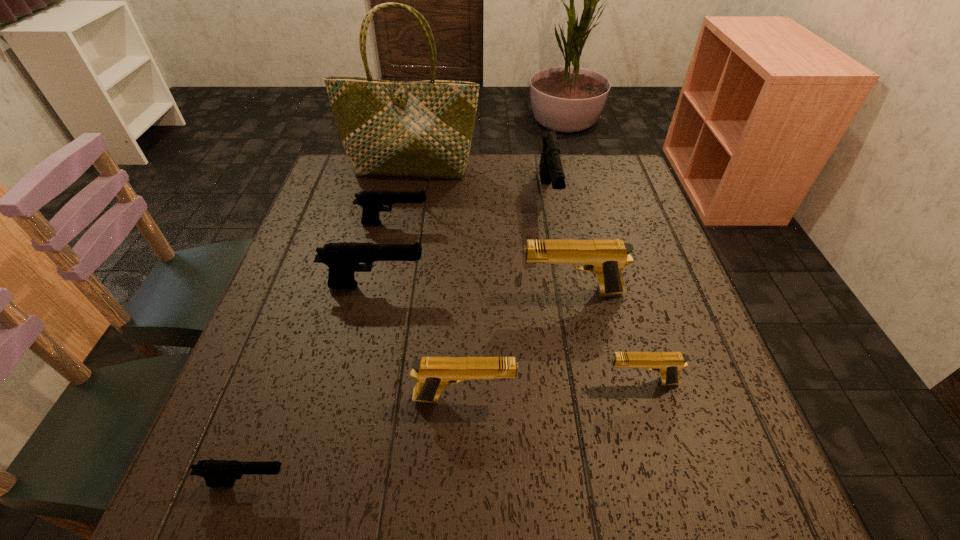
I want to click on free space located 0.400m at the barrel of the third nearest pistol, so click(386, 382).

Identify the location of vacant space located 0.110m at the barrel of the third nearest pistol. This screenshot has height=540, width=960. (544, 382).

Where is `free spot located at the barrel of the third nearest pistol`? free spot located at the barrel of the third nearest pistol is located at coordinates (506, 382).

The height and width of the screenshot is (540, 960). I want to click on vacant space located 0.060m on the front-facing side of the smallest black pistol, so click(x=331, y=483).

Identify the location of shopping bag that is at the far edge. Image resolution: width=960 pixels, height=540 pixels. (393, 128).

Image resolution: width=960 pixels, height=540 pixels. Find the location of `pistol located at the far edge`. pistol located at the far edge is located at coordinates (551, 171).

At what (x,y) coordinates should I click in order to perform the action: click on object that is at the near edge. Please return your answer as a coordinate pair (x, y). The height and width of the screenshot is (540, 960). Looking at the image, I should click on tap(217, 473).

The height and width of the screenshot is (540, 960). What are the coordinates of `shopping bag that is positioned at the left edge` in the screenshot? It's located at (393, 128).

Where is `object present at the far left corner`? The image size is (960, 540). object present at the far left corner is located at coordinates (393, 128).

Find the location of a particular element. object that is positioned at the near left corner is located at coordinates (217, 473).